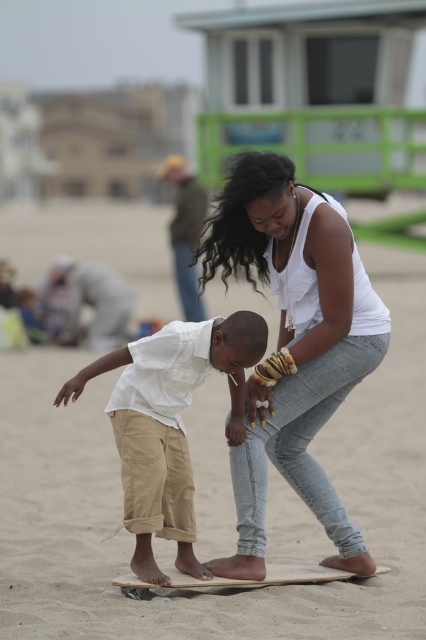
You are a photographer trying to capture a candid shot of the white matte tank top at center and the wooden skateboard at center. Since you want to ensure both subjects are in frame, which object should you position your camera closer to in order to include both?

The white matte tank top at center is to the right of the wooden skateboard at center, so positioning the camera closer to the wooden skateboard at center would allow both subjects to be captured in the frame.

You are a photographer at the beach scene. You need to capture a photo where the white cotton shirt at center and the wooden skateboard at center are both clearly visible. Based on their positions, which object should you focus on first to ensure both are in focus?

The white cotton shirt at center is above the wooden skateboard at center, so focusing on the shirt first will ensure both are in focus since it is closer to the camera.